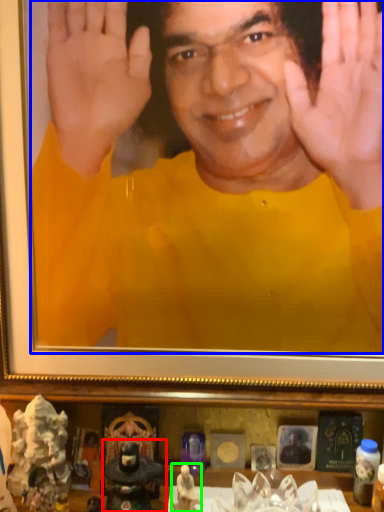
Question: Which object is positioned farthest from figurine (highlighted by a red box)? Select from man (highlighted by a blue box) and toy (highlighted by a green box).

Choices:
 (A) man
 (B) toy

Answer: (A)